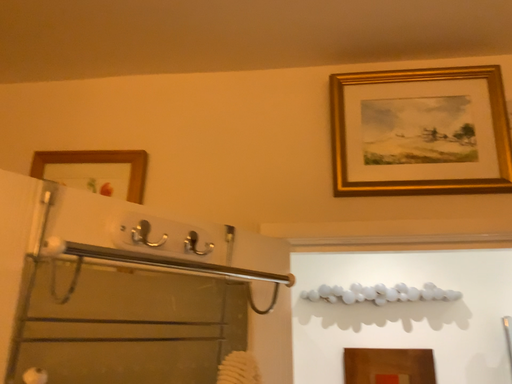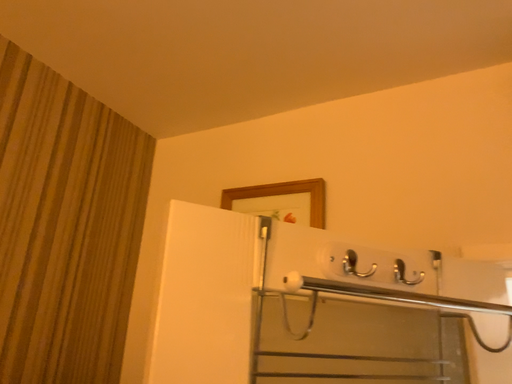
Question: Which way did the camera rotate in the video?

Choices:
 (A) rotated left
 (B) rotated right

Answer: (A)